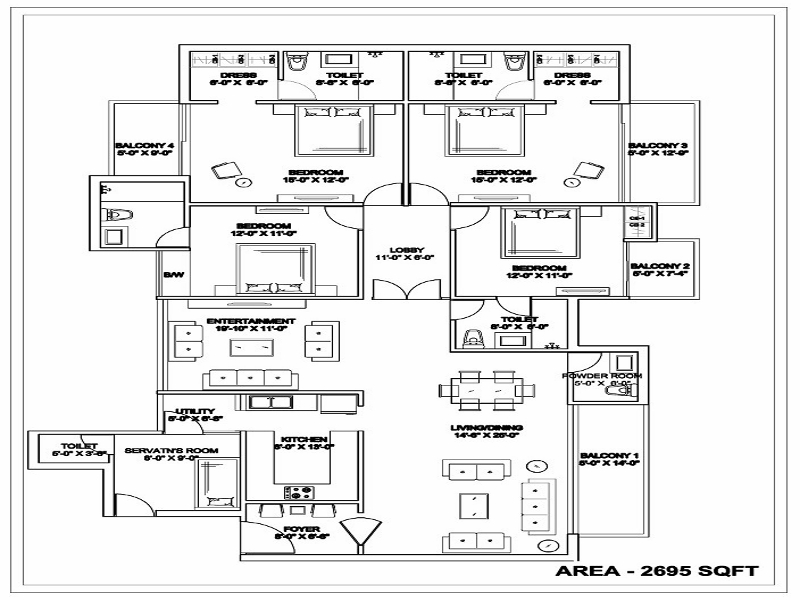
The height and width of the screenshot is (600, 800). Find the location of `4 toilets`. 4 toilets is located at coordinates (332, 79), (486, 78), (518, 318), (72, 448).